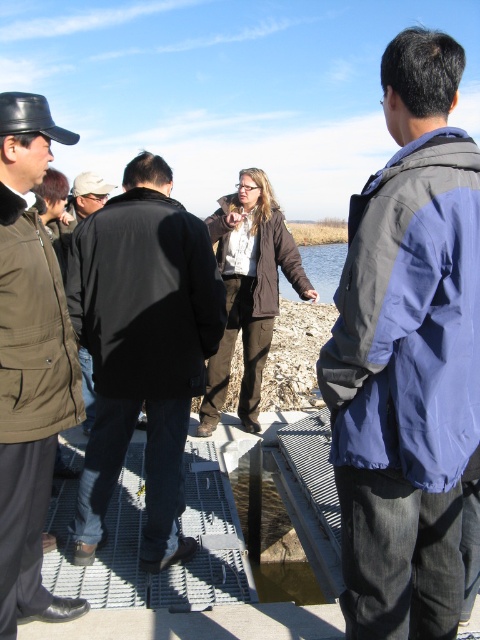
From the picture: You are part of the group standing near the water. You want to hand a document to the person wearing the black matte jacket at center without getting it wet. Since the clear water at center is nearby, which object should you approach first?

The black matte jacket at center is closer to you than the clear water at center, so you should approach the black matte jacket at center first to hand the document safely without getting it wet.

You are part of the group near the water and want to hand a document to the person in the black matte jacket at center. Which direction should you move to approach them from the blue fabric jacket at upper right?

Since the blue fabric jacket at upper right is closer to the viewer than the black matte jacket at center, you should move towards the center of the group away from your current position near the upper right to reach the black matte jacket at center.